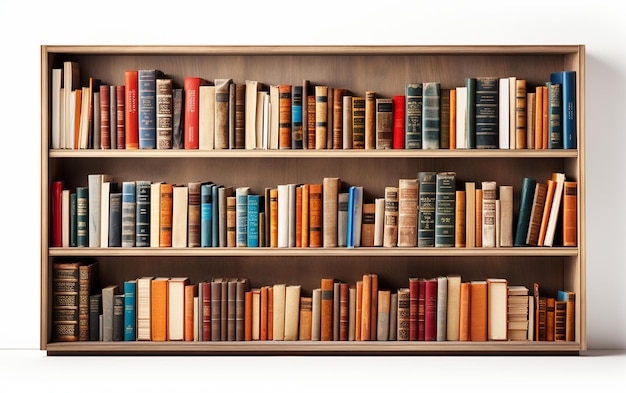
I want to click on books with blue in cover/binding, so click(x=131, y=304), click(x=562, y=294), click(x=351, y=221), click(x=254, y=230), click(x=206, y=224), click(x=295, y=114), click(x=567, y=125).